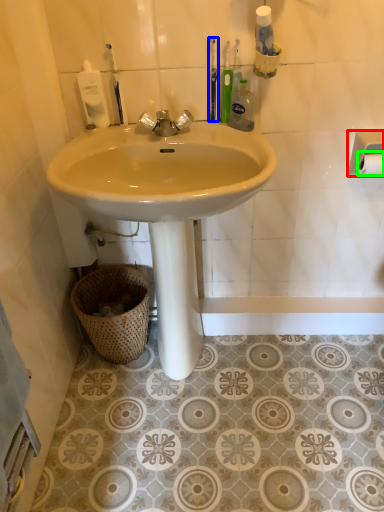
Question: Which is farther away from towel bar (highlighted by a red box)? toothbrush (highlighted by a blue box) or toilet paper (highlighted by a green box)?

Choices:
 (A) toothbrush
 (B) toilet paper

Answer: (A)